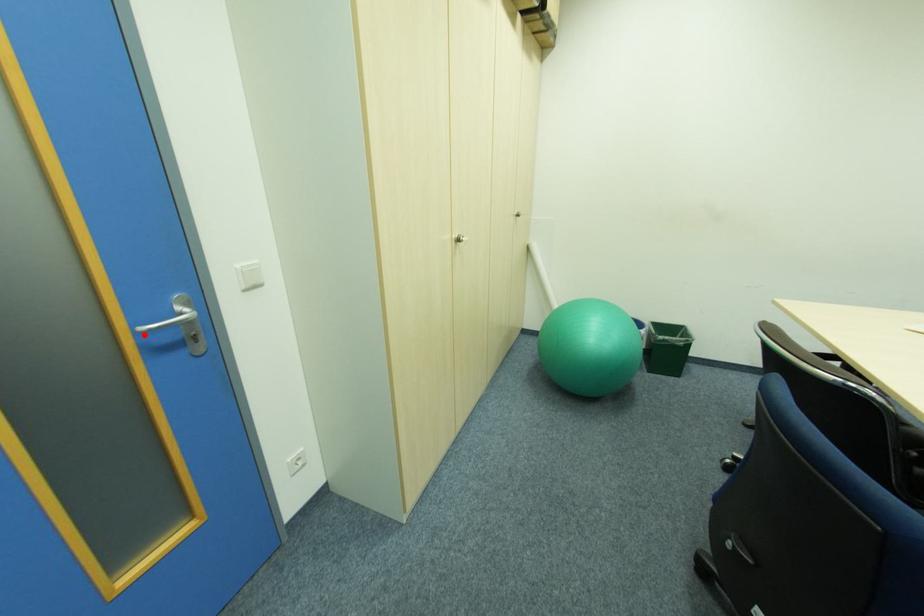
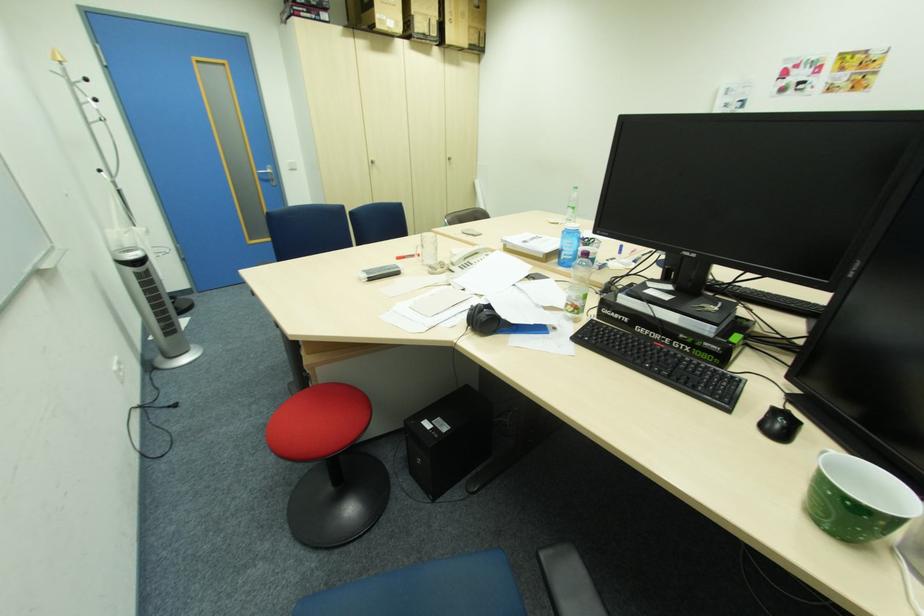
Question: I am providing you with two images of the same scene from different viewpoints. Given a red point in image1, look at the same physical point in image2. Is it:

Choices:
 (A) Closer to the viewpoint
 (B) Farther from the viewpoint

Answer: (A)